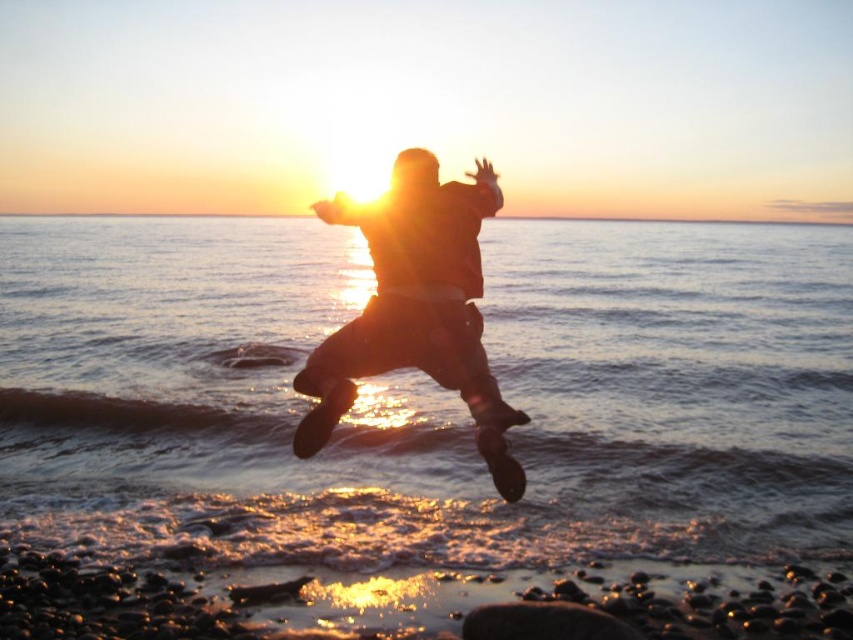
You are trying to determine the position of the silhouette leather jacket at center relative to the translucent water at center in the sunset scene. Which object is located to the left?

The silhouette leather jacket at center is located to the left of the translucent water at center because the translucent water at center is positioned on the right side of the silhouette leather jacket at center.

You are a photographer trying to capture the silhouette of the person jumping. You notice the silhouette leather jacket at center and the translucent water at center in your frame. Which object takes up more horizontal space in the photo?

The translucent water at center takes up more horizontal space than the silhouette leather jacket at center because its width is larger.

You are a photographer trying to capture the silhouette leather jacket at center and the translucent water at center in a single shot. Which object will appear closer to the camera in the photo?

The silhouette leather jacket at center will appear closer to the camera because it is positioned closer to the viewer than the translucent water at center.